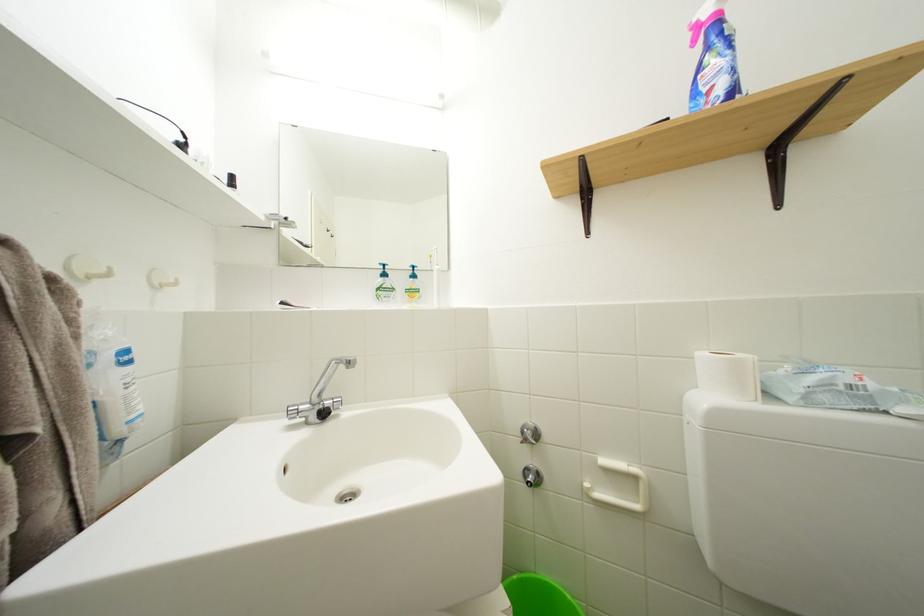
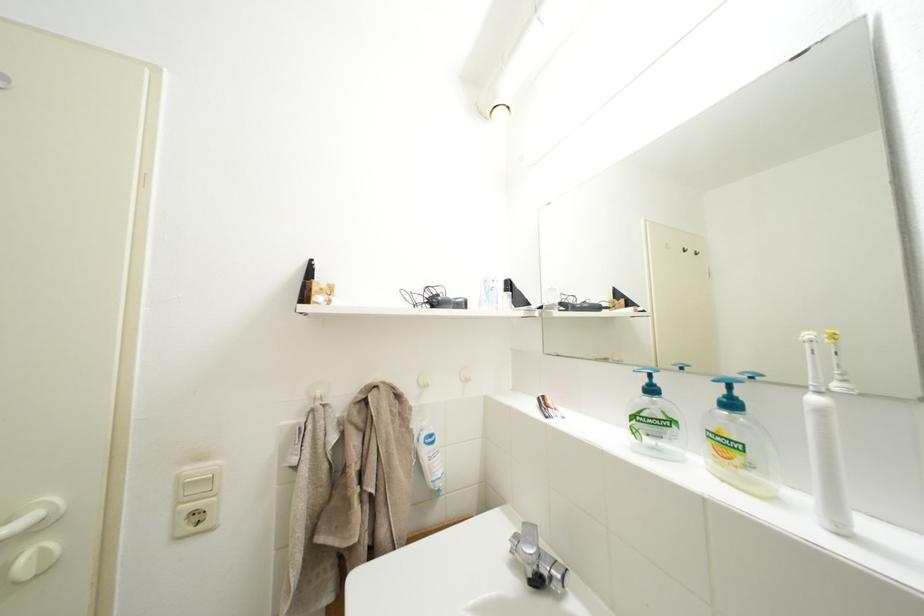
Question: Based on the continuous images, in which direction is the camera rotating? Reply with the corresponding letter.

Choices:
 (A) Left
 (B) Right
 (C) Up
 (D) Down

Answer: (A)